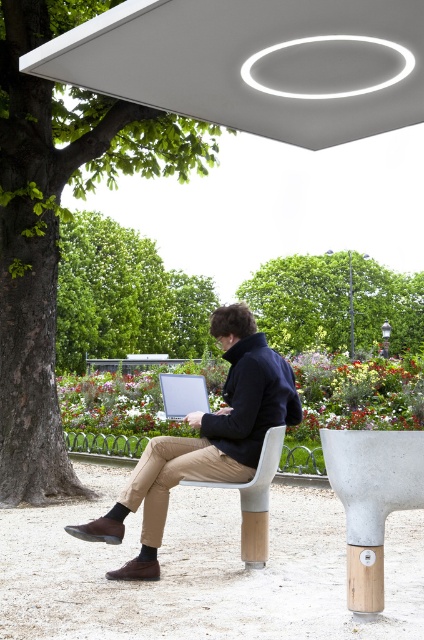
You are planning to place a new bench in the park. The existing bench is located where the matte black jacket at center is sitting. You want to ensure that the new bench is placed far enough from the green leafy tree at left so that it doesn not block the tree view. Based on the current arrangement, do you think the existing bench is positioned far enough away from the tree to avoid blocking its view?

The green leafy tree at left might be wider than the matte black jacket at center, so the existing bench may be too close to the tree. To ensure the tree isn not blocked, the new bench should be placed further away from the green leafy tree at left than the current position of the matte black jacket at center.

You are planning to place a new bench in the park, and you want to ensure there is enough space between the green leafy tree at left and the satin silver laptop at center for people to walk comfortably. Based on the image, which object has a wider width that might require more consideration for spacing?

The green leafy tree at left has a larger width than the satin silver laptop at center, so it requires more consideration for spacing.

You are standing at the entrance of the park and see the green leafy tree at left and the matte black jacket at center. Which object is closer to you?

The green leafy tree at left is closer to you because the matte black jacket at center is behind it.